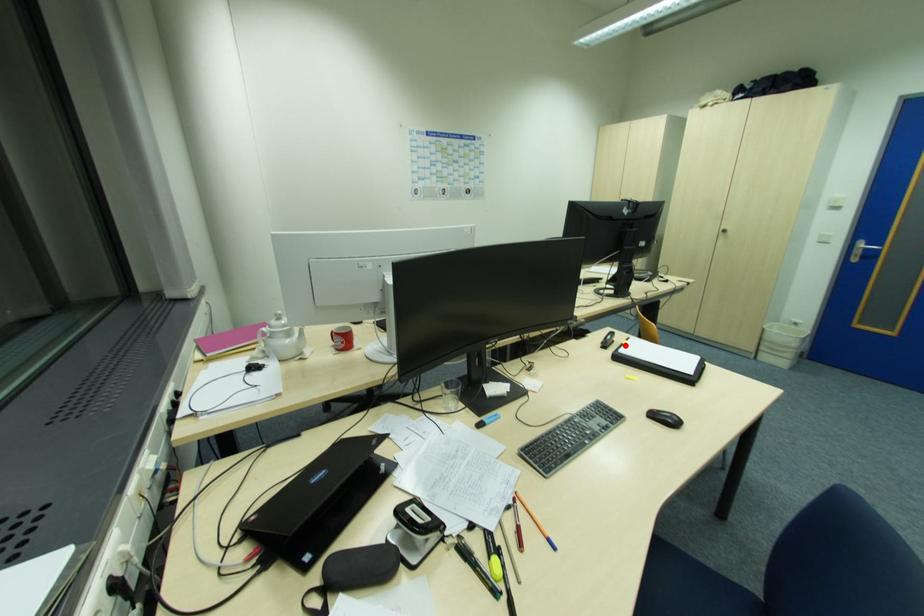
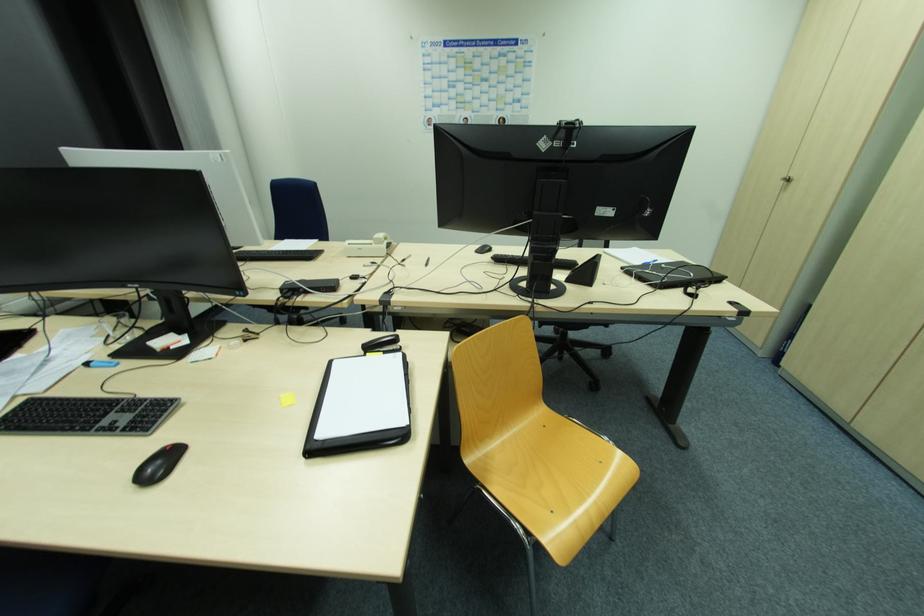
Where in the second image is the point corresponding to the highlighted location from the first image?

(368, 357)